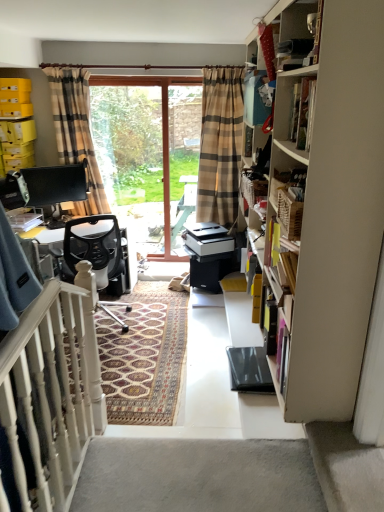
At what (x,y) coordinates should I click in order to perform the action: click on vacant space situated above clear glass screen door at center (from a real-world perspective). Please return your answer as a coordinate pair (x, y). Looking at the image, I should click on (121, 80).